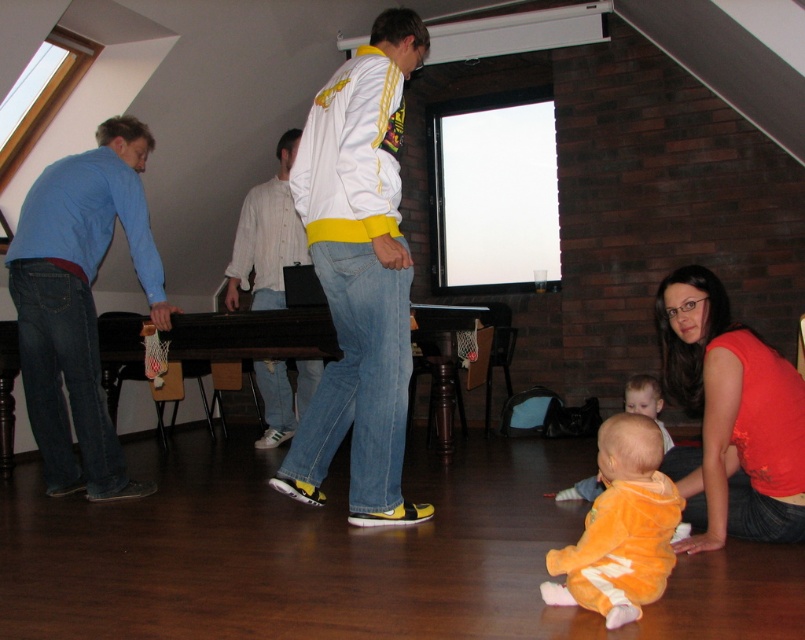
Question: Estimate the real-world distances between objects in this image. Which object is closer to the white cotton shirt at center?

Choices:
 (A) blue cotton shirt at left
 (B) white matte jacket at center
 (C) orange plush onesie at lower center

Answer: (A)

Question: Among these objects, which one is nearest to the camera?

Choices:
 (A) orange plush onesie at lower center
 (B) white cotton shirt at center
 (C) orange plush baby at lower center
 (D) matte orange shirt at lower right

Answer: (A)

Question: Considering the relative positions of blue cotton shirt at left and orange plush onesie at lower center in the image provided, where is blue cotton shirt at left located with respect to orange plush onesie at lower center?

Choices:
 (A) left
 (B) right

Answer: (A)

Question: Does blue cotton shirt at left appear on the left side of orange plush baby at lower center?

Choices:
 (A) no
 (B) yes

Answer: (B)

Question: Does blue cotton shirt at left have a lesser width compared to white cotton shirt at center?

Choices:
 (A) no
 (B) yes

Answer: (A)

Question: Which of the following is the farthest from the observer?

Choices:
 (A) orange plush onesie at lower center
 (B) orange plush baby at lower center
 (C) white matte jacket at center

Answer: (B)